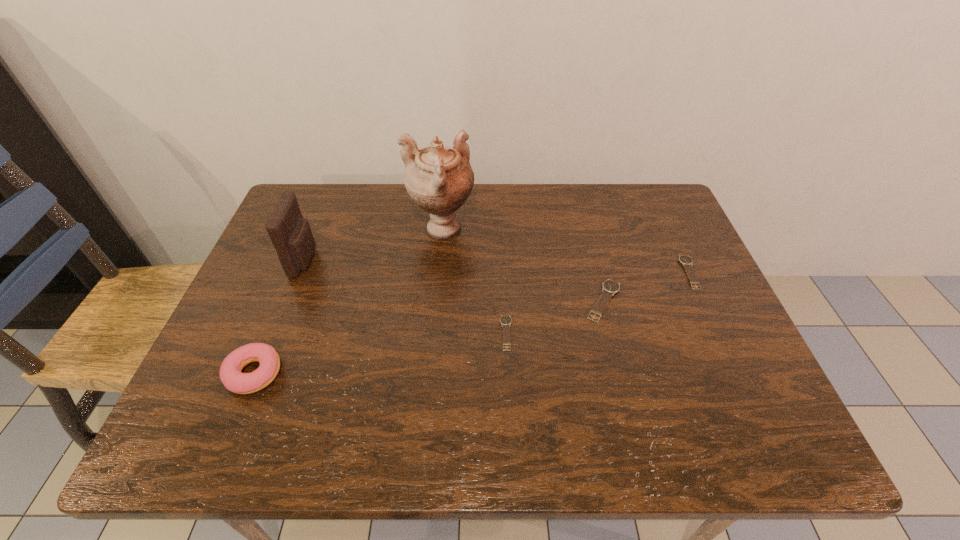
You are a GUI agent. You are given a task and a screenshot of the screen. Output one action in this format:
    pyautogui.click(x=<x>, y=<y>)
    Task: Click on the nearest object
    Image resolution: width=960 pixels, height=540 pixels.
    Given the screenshot: What is the action you would take?
    pyautogui.click(x=231, y=376)

You are a GUI agent. You are given a task and a screenshot of the screen. Output one action in this format:
    pyautogui.click(x=<x>, y=<y>)
    Task: Click on the vacant space located 0.110m on the left of the fourth object from left to right
    The image size is (960, 540).
    Given the screenshot: What is the action you would take?
    point(452,333)

The height and width of the screenshot is (540, 960). I want to click on blank area located on the front of the tallest watch, so click(x=619, y=360).

The image size is (960, 540). What are the coordinates of `vacant space located 0.200m on the front of the second shortest object` in the screenshot? It's located at (730, 357).

This screenshot has width=960, height=540. I want to click on vacant space located 0.150m with an open flap on the pouch, so click(x=372, y=260).

This screenshot has height=540, width=960. What are the coordinates of `free space located on the left of the fourth object from right to left` in the screenshot? It's located at (389, 230).

This screenshot has width=960, height=540. I want to click on vacant space located 0.070m on the right of the third tallest object, so click(x=314, y=374).

At what (x,y) coordinates should I click in order to perform the action: click on object at the far edge. Please return your answer as a coordinate pair (x, y). Looking at the image, I should click on (439, 179).

Image resolution: width=960 pixels, height=540 pixels. What are the coordinates of `object that is at the near edge` in the screenshot? It's located at pyautogui.click(x=231, y=376).

Where is `pouch located at the left edge`? Image resolution: width=960 pixels, height=540 pixels. pouch located at the left edge is located at coordinates (291, 235).